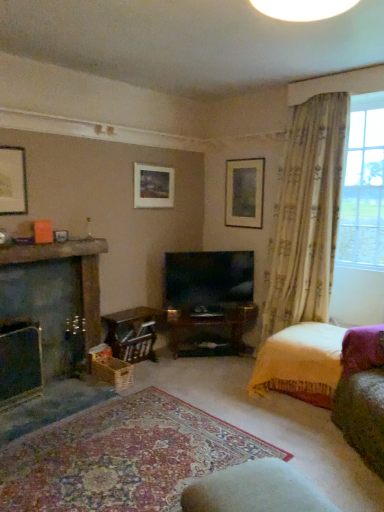
Question: Which direction should I rotate to look at matte wooden picture frame at upper center, placed as the 3th picture frame when sorted from left to right?

Choices:
 (A) right
 (B) left

Answer: (A)

Question: Is matte black picture frame at upper left, acting as the first picture frame starting from the front, in front of velvet yellow bed at lower right?

Choices:
 (A) no
 (B) yes

Answer: (A)

Question: Does matte black picture frame at upper left, the 3th picture frame from the back, have a larger size compared to velvet yellow bed at lower right?

Choices:
 (A) yes
 (B) no

Answer: (B)

Question: Is matte black picture frame at upper left, acting as the first picture frame starting from the front, smaller than velvet yellow bed at lower right?

Choices:
 (A) no
 (B) yes

Answer: (B)

Question: Can you confirm if matte black picture frame at upper left, the first picture frame when ordered from left to right, is thinner than velvet yellow bed at lower right?

Choices:
 (A) no
 (B) yes

Answer: (B)

Question: Can you confirm if matte black picture frame at upper left, the first picture frame when ordered from left to right, is wider than velvet yellow bed at lower right?

Choices:
 (A) yes
 (B) no

Answer: (B)

Question: Is matte black picture frame at upper left, the 3th picture frame from the back, at the left side of velvet yellow bed at lower right?

Choices:
 (A) yes
 (B) no

Answer: (A)

Question: From the image's perspective, is flat-screen tv at center over white fabric rocking chair at lower center?

Choices:
 (A) no
 (B) yes

Answer: (B)

Question: Is flat-screen tv at center behind white fabric rocking chair at lower center?

Choices:
 (A) no
 (B) yes

Answer: (B)

Question: Is flat-screen tv at center positioned with its back to white fabric rocking chair at lower center?

Choices:
 (A) no
 (B) yes

Answer: (A)

Question: Is flat-screen tv at center thinner than white fabric rocking chair at lower center?

Choices:
 (A) yes
 (B) no

Answer: (A)

Question: Does flat-screen tv at center touch white fabric rocking chair at lower center?

Choices:
 (A) yes
 (B) no

Answer: (B)

Question: Is flat-screen tv at center outside of white fabric rocking chair at lower center?

Choices:
 (A) yes
 (B) no

Answer: (A)

Question: Can you confirm if matte gold picture frame at upper center, positioned as the second picture frame in back-to-front order, is positioned to the right of matte black picture frame at upper left, the first picture frame when ordered from left to right?

Choices:
 (A) yes
 (B) no

Answer: (A)